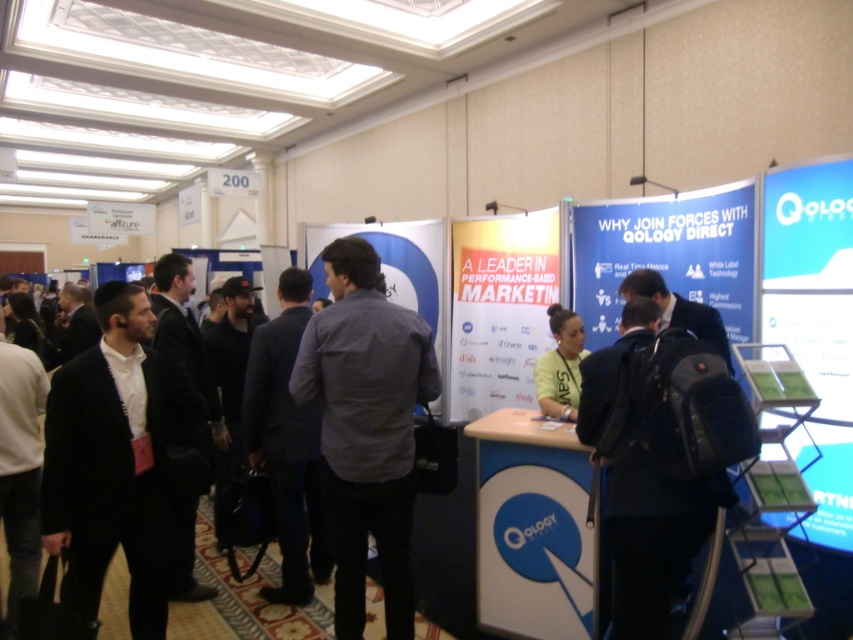
Question: Is black matte suit at left wider than dark gray suit at center?

Choices:
 (A) no
 (B) yes

Answer: (B)

Question: Observing the image, what is the correct spatial positioning of black matte suit at left in reference to dark gray suit at center?

Choices:
 (A) left
 (B) right

Answer: (A)

Question: Which of these objects is positioned closest to the black fabric backpack at center?

Choices:
 (A) dark gray suit at center
 (B) black matte suit at left

Answer: (A)

Question: Observing the image, what is the correct spatial positioning of black matte suit at left in reference to dark gray suit at center?

Choices:
 (A) right
 (B) left

Answer: (B)

Question: Estimate the real-world distances between objects in this image. Which object is farther from the yellow fabric shirt at center?

Choices:
 (A) black fabric backpack at center
 (B) black matte suit at left
 (C) dark gray suit at center

Answer: (B)

Question: Which is nearer to the black fabric backpack at center?

Choices:
 (A) yellow fabric shirt at center
 (B) dark gray suit at center

Answer: (A)